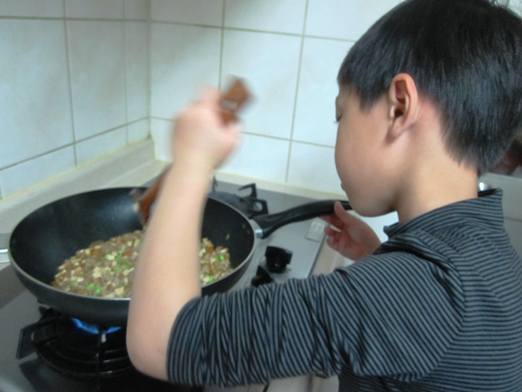
Locate an element on the screen. This screenshot has height=392, width=522. food in skillet is located at coordinates (99, 264).